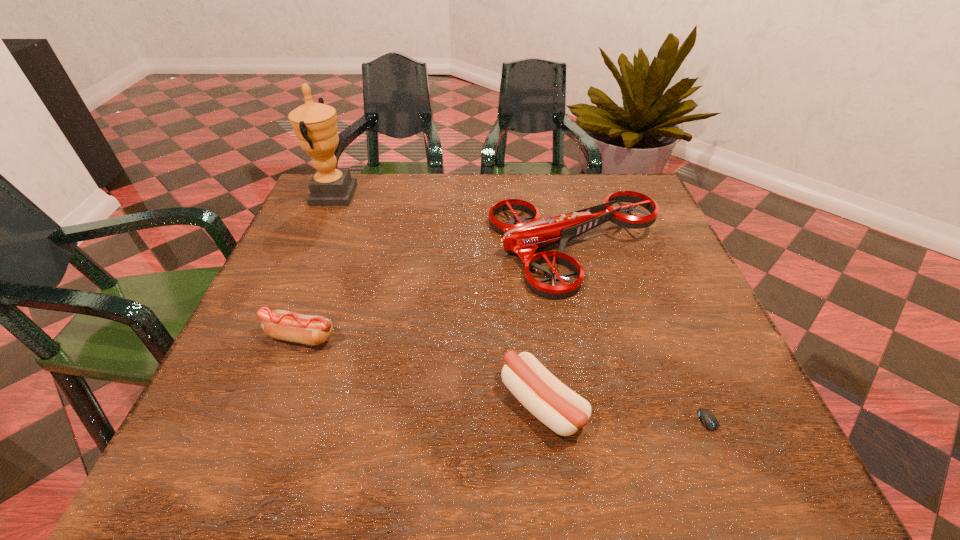
Find the location of a particular element. This screenshot has width=960, height=540. vacant space that is in between the award and the shortest object is located at coordinates (523, 315).

You are a GUI agent. You are given a task and a screenshot of the screen. Output one action in this format:
    pyautogui.click(x=<x>, y=<y>)
    Task: Click on the empty space between the right sausage and the drone
    The image size is (960, 540).
    Given the screenshot: What is the action you would take?
    pyautogui.click(x=559, y=327)

You are a GUI agent. You are given a task and a screenshot of the screen. Output one action in this format:
    pyautogui.click(x=<x>, y=<y>)
    Task: Click on the empty space between the drone and the third nearest object
    This screenshot has height=540, width=960.
    Given the screenshot: What is the action you would take?
    pyautogui.click(x=438, y=293)

You are a GUI agent. You are given a task and a screenshot of the screen. Output one action in this format:
    pyautogui.click(x=<x>, y=<y>)
    Task: Click on the free spot between the drone and the right sausage
    This screenshot has height=540, width=960.
    Given the screenshot: What is the action you would take?
    pyautogui.click(x=559, y=327)

Where is `vacant space that's between the shortest object and the award`? The height and width of the screenshot is (540, 960). vacant space that's between the shortest object and the award is located at coordinates (523, 315).

This screenshot has height=540, width=960. What are the coordinates of `free space between the second tallest object and the third nearest object` in the screenshot? It's located at (438, 293).

Identify which object is the second closest to the shortest object. Please provide its 2D coordinates. Your answer should be formatted as a tuple, i.e. [(x, y)], where the tuple contains the x and y coordinates of a point satisfying the conditions above.

[(523, 239)]

Select which object is the closest to the mouse. Please provide its 2D coordinates. Your answer should be formatted as a tuple, i.e. [(x, y)], where the tuple contains the x and y coordinates of a point satisfying the conditions above.

[(561, 409)]

This screenshot has height=540, width=960. Identify the location of vacant space that satisfies the following two spatial constraints: 1. at the front of the tallest object with handles; 2. on the back side of the mouse. (226, 435).

Find the location of `free point that satisfies the following two spatial constraints: 1. at the front of the nearer sausage with handles; 2. on the left side of the award`. free point that satisfies the following two spatial constraints: 1. at the front of the nearer sausage with handles; 2. on the left side of the award is located at coordinates (239, 404).